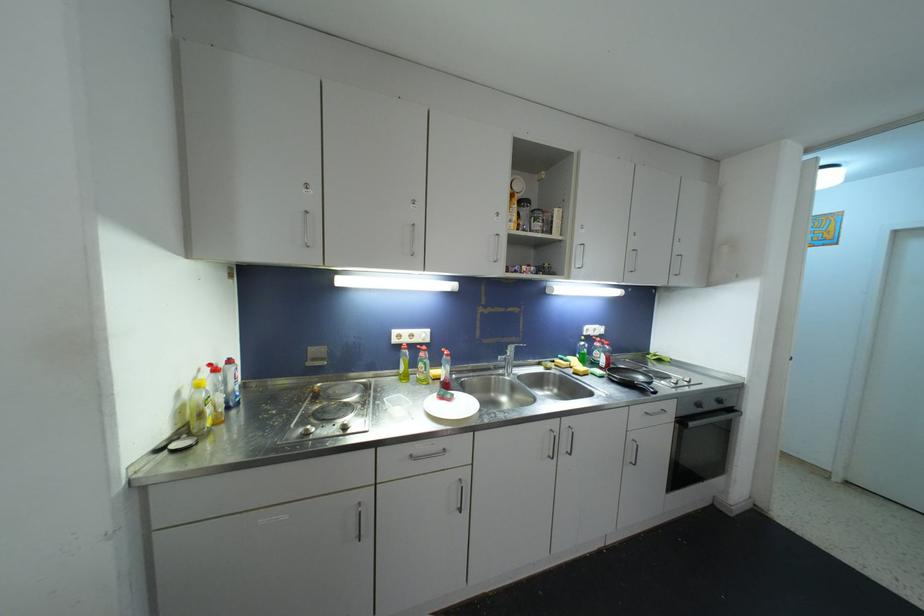
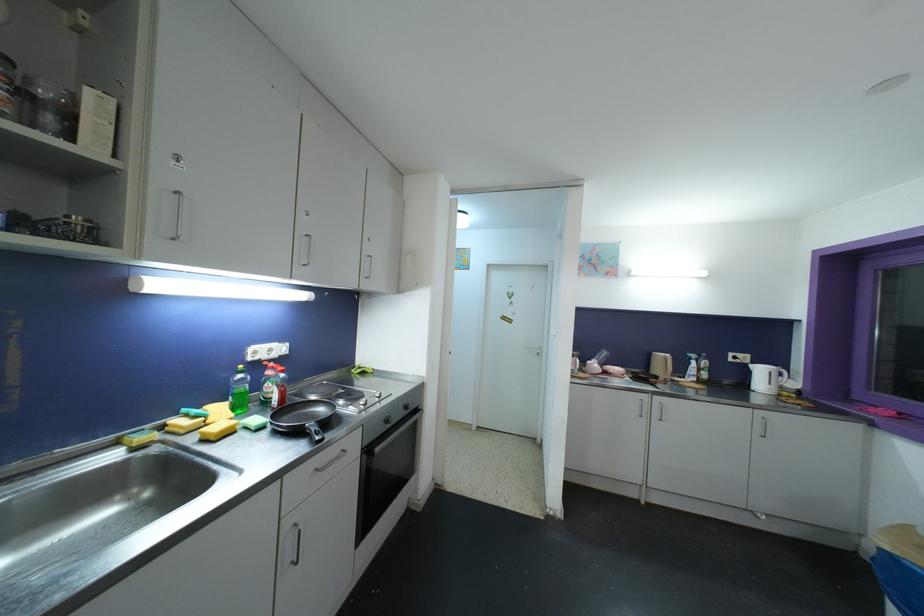
Find the pixel in the second image that matches [586,346] in the first image.

(244, 379)